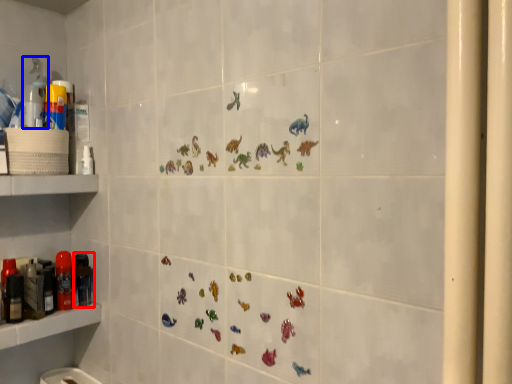
Question: Which object appears closest to the camera in this image, toiletry (highlighted by a red box) or cleaning product (highlighted by a blue box)?

Choices:
 (A) toiletry
 (B) cleaning product

Answer: (B)